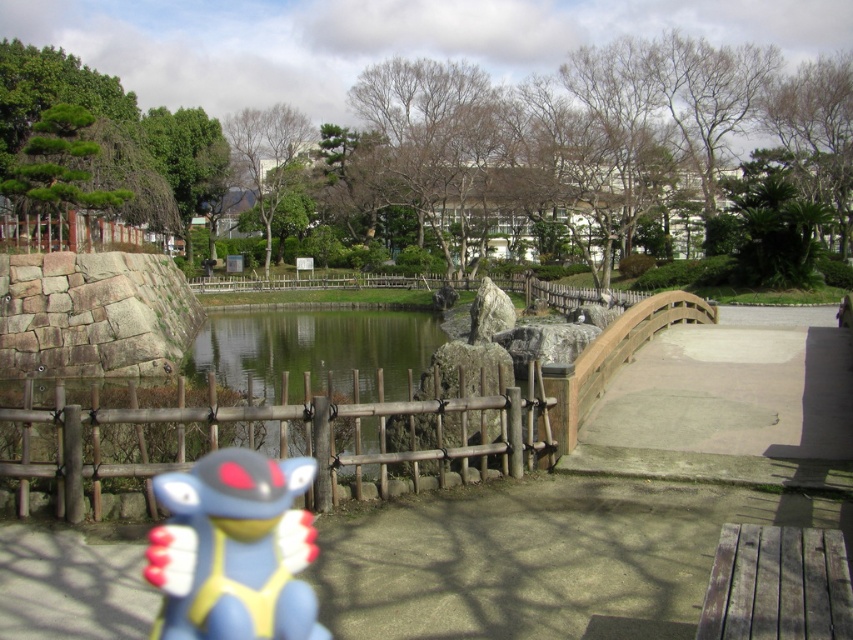
Question: Is blue rubber toy at lower left bigger than green reflective water at center?

Choices:
 (A) yes
 (B) no

Answer: (B)

Question: Among these points, which one is nearest to the camera?

Choices:
 (A) (265, 618)
 (B) (267, 364)

Answer: (A)

Question: Does wooden fence at center lie behind green reflective water at center?

Choices:
 (A) no
 (B) yes

Answer: (A)

Question: Is blue rubber toy at lower left further to the viewer compared to green reflective water at center?

Choices:
 (A) no
 (B) yes

Answer: (A)

Question: Which is nearer to the blue rubber toy at lower left?

Choices:
 (A) green reflective water at center
 (B) wooden fence at center

Answer: (B)

Question: Which point is farther from the camera taking this photo?

Choices:
 (A) (311, 426)
 (B) (259, 310)

Answer: (B)